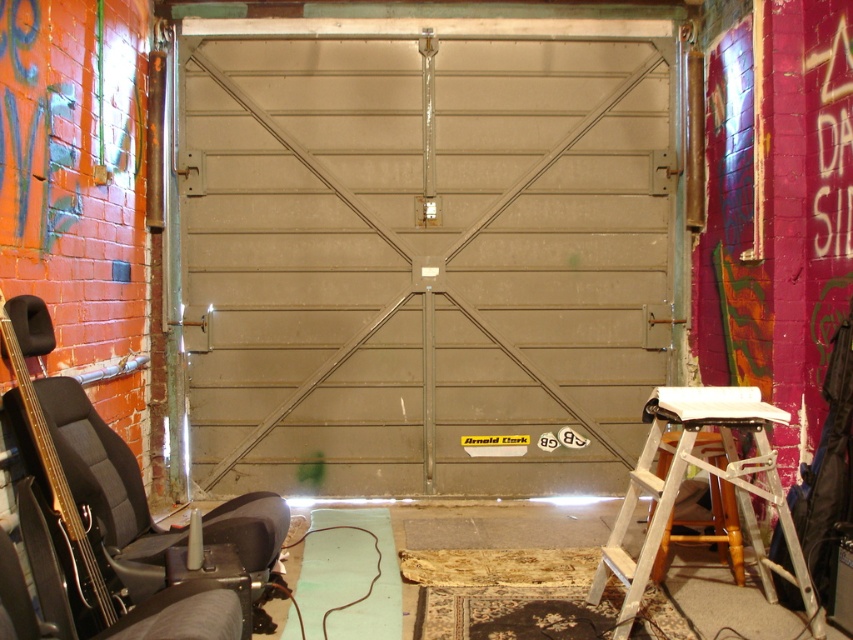
You are standing in the garage and want to place a new sticker on the wall. You have two points marked as point coordinates. Which point is further away from you, point (764, 577) or point (82, 394)?

Point (764, 577) is behind point (82, 394), so it is further away from you.

You are standing in the garage and want to reach the top of the white metallic ladder at lower right. However, there is a black leather chair at lower left in the way. Can you move the chair to access the ladder?

The white metallic ladder at lower right is located below the black leather chair at lower left. Since the ladder is underneath the chair, moving the chair would allow you to access the ladder.

You need to move the white metallic ladder at lower right to store it against the wall. The metallic gray garage door at center is in the way. Can you move the ladder around the door without bending it?

The metallic gray garage door at center is wider than the white metallic ladder at lower right. Since the door is wider, there might be enough space on either side to maneuver the ladder around it without bending it, provided the surrounding area is clear.